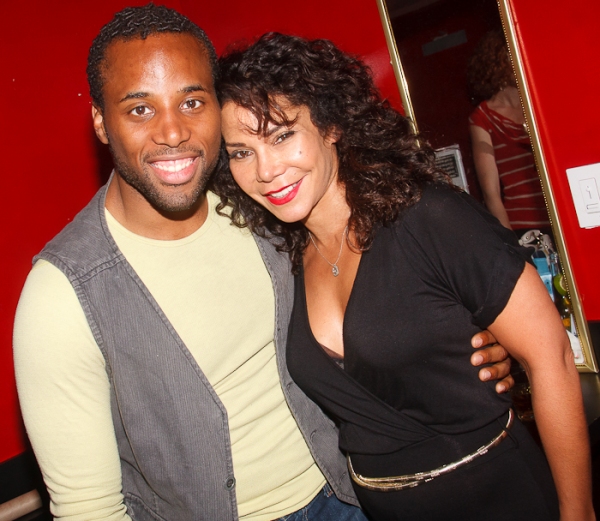
Locate an element on the screen. light switch is located at coordinates (584, 201).